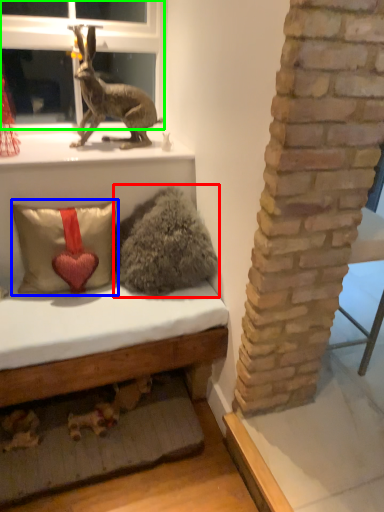
Question: Which object is positioned closest to animal (highlighted by a red box)? Select from pillow (highlighted by a blue box) and bay window (highlighted by a green box).

Choices:
 (A) pillow
 (B) bay window

Answer: (A)